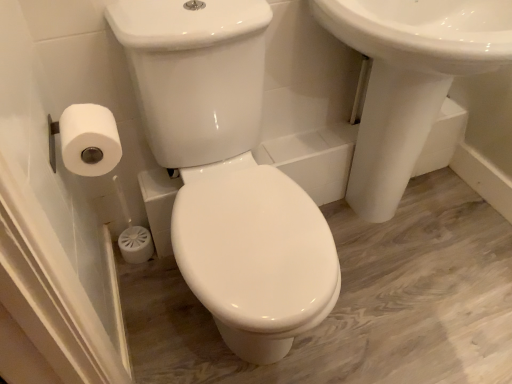
In order to click on vacant area situated below white glossy sink at upper right (from a real-world perspective) in this screenshot , I will do `click(394, 225)`.